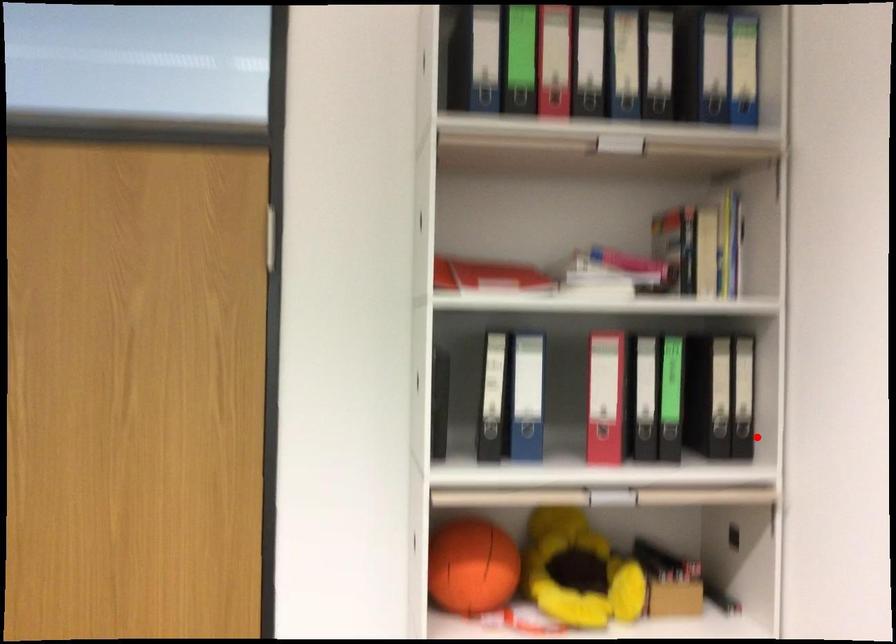
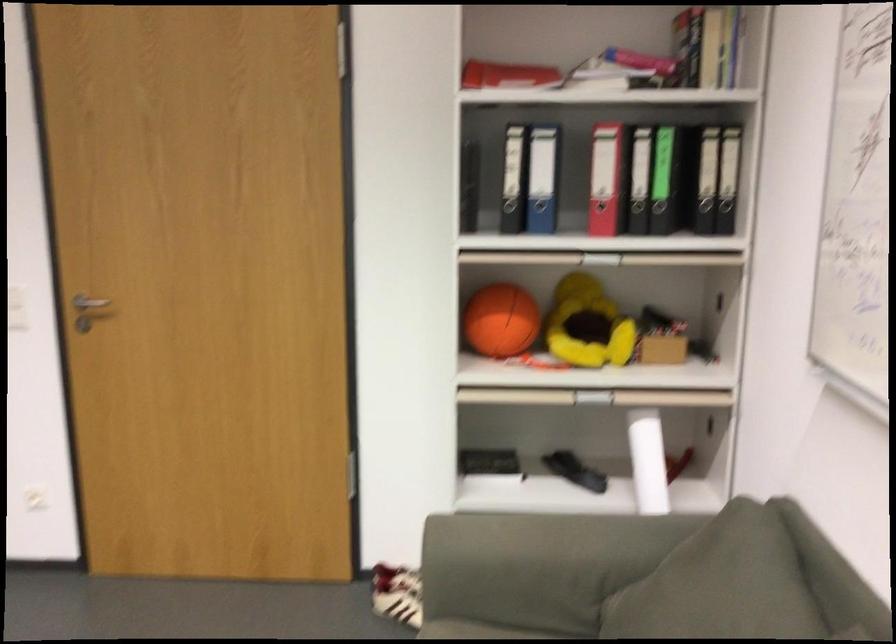
The point at the highlighted location is marked in the first image. Where is the corresponding point in the second image?

(734, 214)